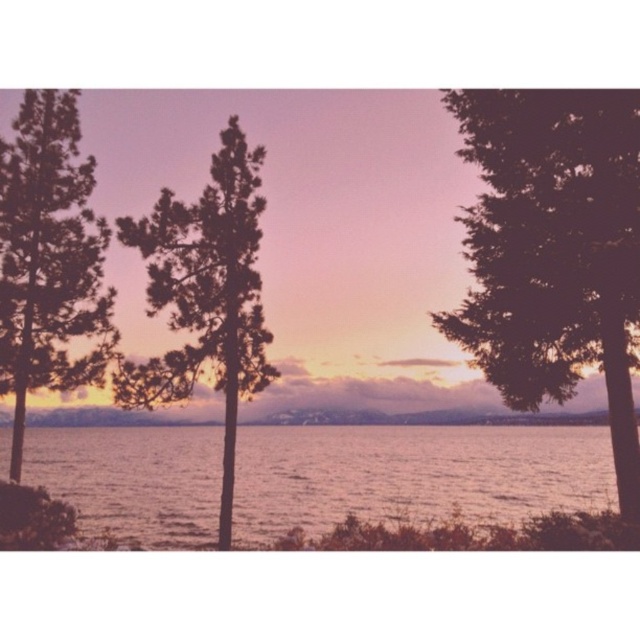
Question: Which of the following is the farthest from the observer?

Choices:
 (A) (557, 360)
 (B) (467, 429)

Answer: (B)

Question: Which object is farther from the camera taking this photo?

Choices:
 (A) green matte tree at center
 (B) dark green textured tree at right
 (C) green textured tree at left

Answer: (C)

Question: Does green textured tree at left appear on the right side of green matte tree at center?

Choices:
 (A) yes
 (B) no

Answer: (B)

Question: Which point is closer to the camera taking this photo?

Choices:
 (A) (358, 515)
 (B) (36, 342)

Answer: (B)

Question: Is green textured tree at left bigger than green matte tree at center?

Choices:
 (A) no
 (B) yes

Answer: (A)

Question: Considering the relative positions of smooth water at center and green textured tree at left in the image provided, where is smooth water at center located with respect to green textured tree at left?

Choices:
 (A) below
 (B) above

Answer: (A)